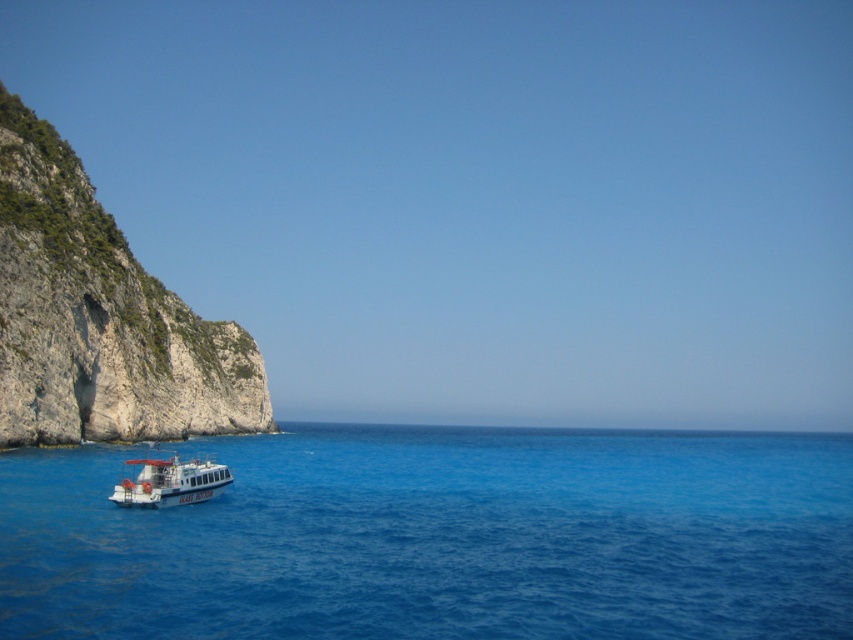
Question: Does blue liquid water at lower left have a smaller size compared to rugged stone cliff at left?

Choices:
 (A) yes
 (B) no

Answer: (B)

Question: Is blue liquid water at lower left closer to camera compared to rugged stone cliff at left?

Choices:
 (A) no
 (B) yes

Answer: (B)

Question: Which object is the farthest from the rugged stone cliff at left?

Choices:
 (A) white glossy boat at lower left
 (B) blue liquid water at lower left

Answer: (A)

Question: Can you confirm if blue liquid water at lower left is smaller than rugged stone cliff at left?

Choices:
 (A) yes
 (B) no

Answer: (B)

Question: Which object is farther from the camera taking this photo?

Choices:
 (A) blue liquid water at lower left
 (B) rugged stone cliff at left
 (C) white glossy boat at lower left

Answer: (B)

Question: Which is nearer to the rugged stone cliff at left?

Choices:
 (A) white glossy boat at lower left
 (B) blue liquid water at lower left

Answer: (B)